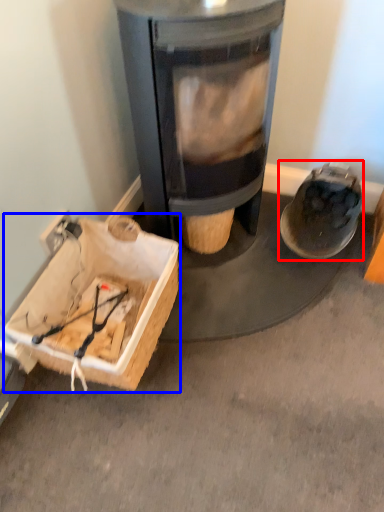
Question: Which object is closer to the camera taking this photo, footwear (highlighted by a red box) or cardboard box (highlighted by a blue box)?

Choices:
 (A) footwear
 (B) cardboard box

Answer: (B)